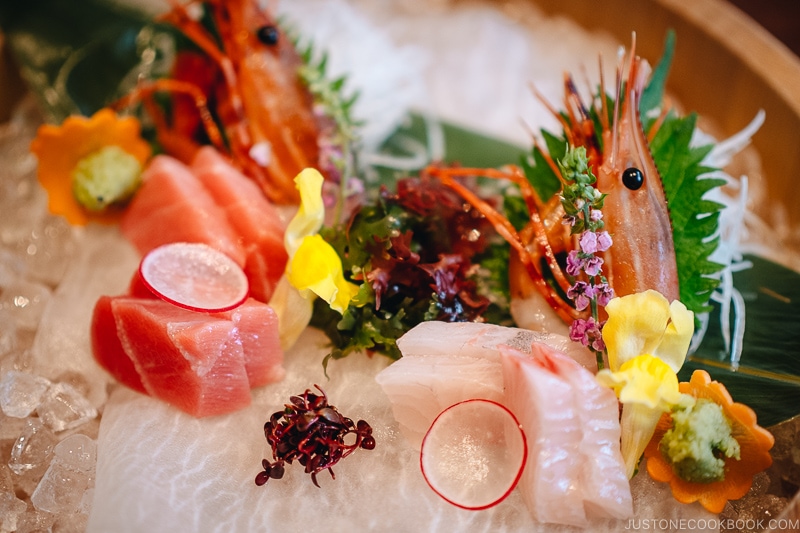
The height and width of the screenshot is (533, 800). Find the location of `wood bowl`. wood bowl is located at coordinates (758, 94).